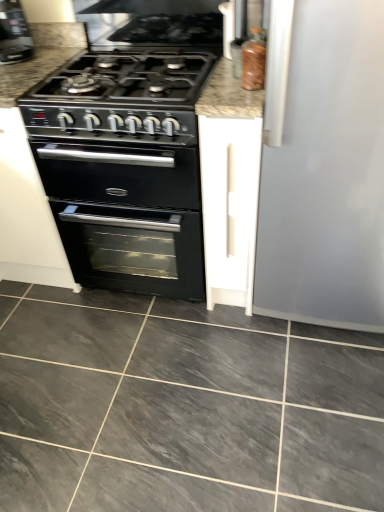
Question: Does white matte cabinet at center appear on the left side of marble countertop at center?

Choices:
 (A) yes
 (B) no

Answer: (B)

Question: Does white matte cabinet at center have a lesser width compared to marble countertop at center?

Choices:
 (A) yes
 (B) no

Answer: (A)

Question: Is white matte cabinet at center far from marble countertop at center?

Choices:
 (A) yes
 (B) no

Answer: (B)

Question: Are white matte cabinet at center and marble countertop at center beside each other?

Choices:
 (A) no
 (B) yes

Answer: (A)

Question: Is white matte cabinet at center facing towards marble countertop at center?

Choices:
 (A) yes
 (B) no

Answer: (B)

Question: From a real-world perspective, is white matte cabinet at center positioned under marble countertop at center based on gravity?

Choices:
 (A) no
 (B) yes

Answer: (B)

Question: Considering the relative sizes of black plastic coffee machine at upper left and translucent amber bottle at upper right in the image provided, is black plastic coffee machine at upper left wider than translucent amber bottle at upper right?

Choices:
 (A) no
 (B) yes

Answer: (B)

Question: Does black plastic coffee machine at upper left have a lesser width compared to translucent amber bottle at upper right?

Choices:
 (A) yes
 (B) no

Answer: (B)

Question: Is black plastic coffee machine at upper left far from translucent amber bottle at upper right?

Choices:
 (A) yes
 (B) no

Answer: (A)

Question: Does black plastic coffee machine at upper left have a larger size compared to translucent amber bottle at upper right?

Choices:
 (A) yes
 (B) no

Answer: (A)

Question: Is black plastic coffee machine at upper left facing away from translucent amber bottle at upper right?

Choices:
 (A) yes
 (B) no

Answer: (B)

Question: Considering the relative sizes of black plastic coffee machine at upper left and translucent amber bottle at upper right in the image provided, is black plastic coffee machine at upper left taller than translucent amber bottle at upper right?

Choices:
 (A) no
 (B) yes

Answer: (B)

Question: Does black plastic coffee machine at upper left have a greater width compared to white matte cabinet at center?

Choices:
 (A) no
 (B) yes

Answer: (A)